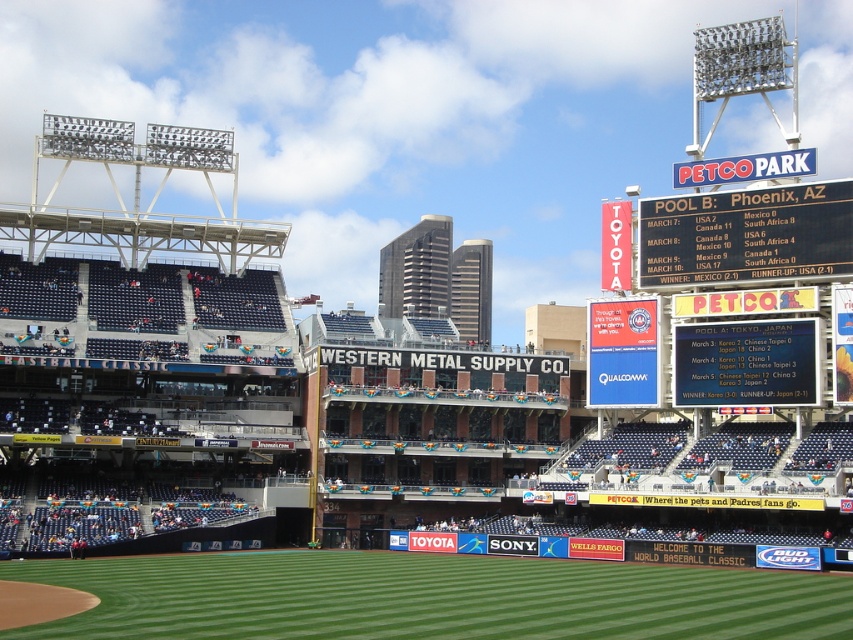
Between green grass at lower center and white plastic scoreboard at upper right, which one has less height?

Standing shorter between the two is green grass at lower center.

Which is more to the right, green grass at lower center or white plastic scoreboard at upper right?

Positioned to the right is white plastic scoreboard at upper right.

The image size is (853, 640). Find the location of `green grass at lower center`. green grass at lower center is located at coordinates (431, 596).

Locate an element on the screen. The width and height of the screenshot is (853, 640). green grass at lower center is located at coordinates (431, 596).

Looking at this image, which is below, black plastic scoreboard at upper right or white plastic scoreboard at upper right?

white plastic scoreboard at upper right is lower down.

Between black plastic scoreboard at upper right and white plastic scoreboard at upper right, which one is positioned higher?

black plastic scoreboard at upper right is above.

Measure the distance between point (x=722, y=273) and camera.

A distance of 261.82 feet exists between point (x=722, y=273) and camera.

Identify the location of black plastic scoreboard at upper right. This screenshot has height=640, width=853. (746, 234).

Is green grass at lower center taller than black plastic scoreboard at upper right?

No, green grass at lower center is not taller than black plastic scoreboard at upper right.

Where is `green grass at lower center`? The width and height of the screenshot is (853, 640). green grass at lower center is located at coordinates (431, 596).